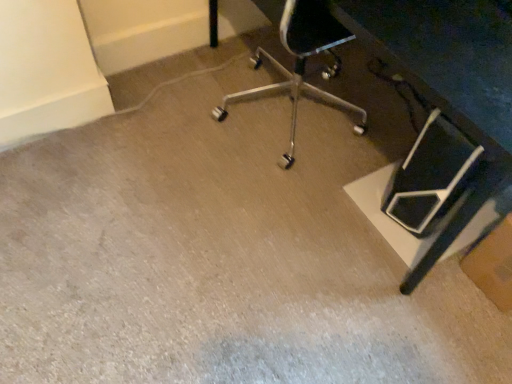
Question: From a real-world perspective, is brown cardboard box at lower right physically below black plastic table at center?

Choices:
 (A) yes
 (B) no

Answer: (A)

Question: From the image's perspective, is brown cardboard box at lower right below black plastic table at center?

Choices:
 (A) no
 (B) yes

Answer: (B)

Question: Is brown cardboard box at lower right far away from black plastic table at center?

Choices:
 (A) yes
 (B) no

Answer: (B)

Question: Is brown cardboard box at lower right at the right side of black plastic table at center?

Choices:
 (A) yes
 (B) no

Answer: (A)

Question: From a real-world perspective, is brown cardboard box at lower right located higher than black plastic table at center?

Choices:
 (A) no
 (B) yes

Answer: (A)

Question: Can you confirm if brown cardboard box at lower right is thinner than black plastic table at center?

Choices:
 (A) yes
 (B) no

Answer: (A)

Question: Is black plastic table at center touching brown cardboard box at lower right?

Choices:
 (A) no
 (B) yes

Answer: (A)

Question: Is black plastic table at center positioned before brown cardboard box at lower right?

Choices:
 (A) no
 (B) yes

Answer: (B)

Question: Does black plastic table at center have a greater width compared to brown cardboard box at lower right?

Choices:
 (A) yes
 (B) no

Answer: (A)

Question: Is black plastic table at center smaller than brown cardboard box at lower right?

Choices:
 (A) no
 (B) yes

Answer: (A)

Question: Is black plastic table at center bigger than brown cardboard box at lower right?

Choices:
 (A) yes
 (B) no

Answer: (A)

Question: From the image's perspective, is black plastic table at center on brown cardboard box at lower right?

Choices:
 (A) no
 (B) yes

Answer: (B)

Question: From a real-world perspective, is brown cardboard box at lower right physically located above or below black plastic table at center?

Choices:
 (A) above
 (B) below

Answer: (B)